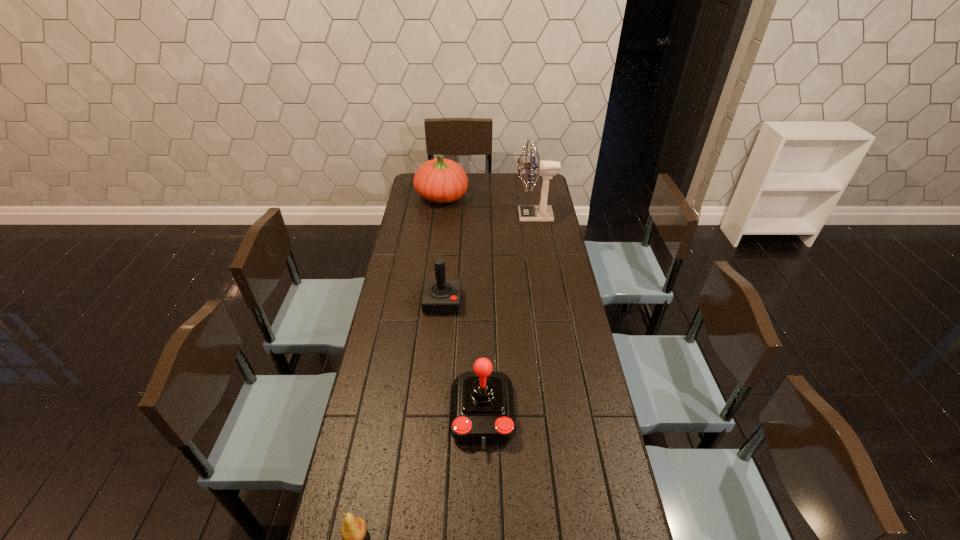
This screenshot has width=960, height=540. I want to click on free space between the rightmost object and the nearer joystick, so click(509, 315).

At what (x,y) coordinates should I click in order to perform the action: click on vacant area that lies between the nearer joystick and the third nearest object. Please return your answer as a coordinate pair (x, y). Image resolution: width=960 pixels, height=540 pixels. Looking at the image, I should click on (463, 359).

Image resolution: width=960 pixels, height=540 pixels. What are the coordinates of `vacant area that lies between the fan and the farther joystick` in the screenshot? It's located at (489, 259).

This screenshot has width=960, height=540. Find the location of `vacant space in between the nearer joystick and the rightmost object`. vacant space in between the nearer joystick and the rightmost object is located at coordinates (509, 315).

Locate an element on the screen. vacant area that lies between the rightmost object and the farther joystick is located at coordinates (489, 259).

Find the location of a particular element. This screenshot has width=960, height=540. free spot between the third nearest object and the pumpkin is located at coordinates (443, 249).

Find the location of a particular element. vacant space that's between the third nearest object and the fan is located at coordinates (489, 259).

Find the location of a particular element. This screenshot has height=540, width=960. free spot between the tallest object and the pumpkin is located at coordinates (488, 206).

Where is `the third closest object to the nearer joystick`? This screenshot has width=960, height=540. the third closest object to the nearer joystick is located at coordinates (547, 169).

Image resolution: width=960 pixels, height=540 pixels. What are the coordinates of `object that ranks as the third closest to the pumpkin` in the screenshot? It's located at (482, 413).